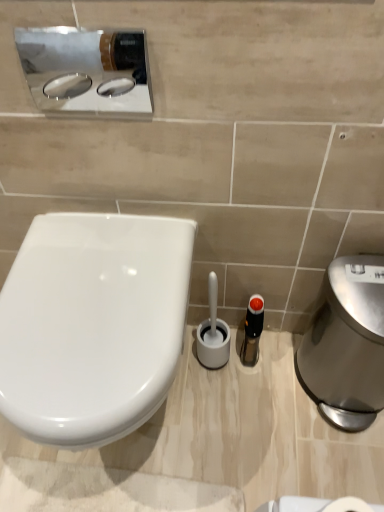
Find the location of a particular element. The image size is (384, 512). vacant area situated to the left side of translucent plastic bottle at center is located at coordinates (198, 383).